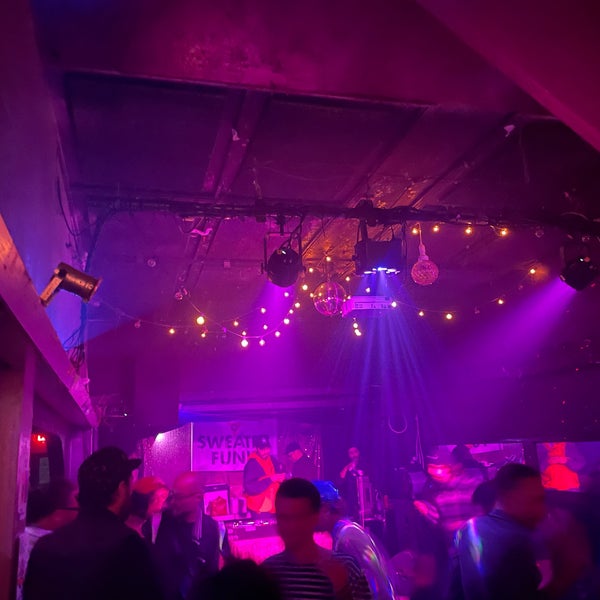
Locate an element on the screen. The width and height of the screenshot is (600, 600). ceiling is located at coordinates (292, 157).